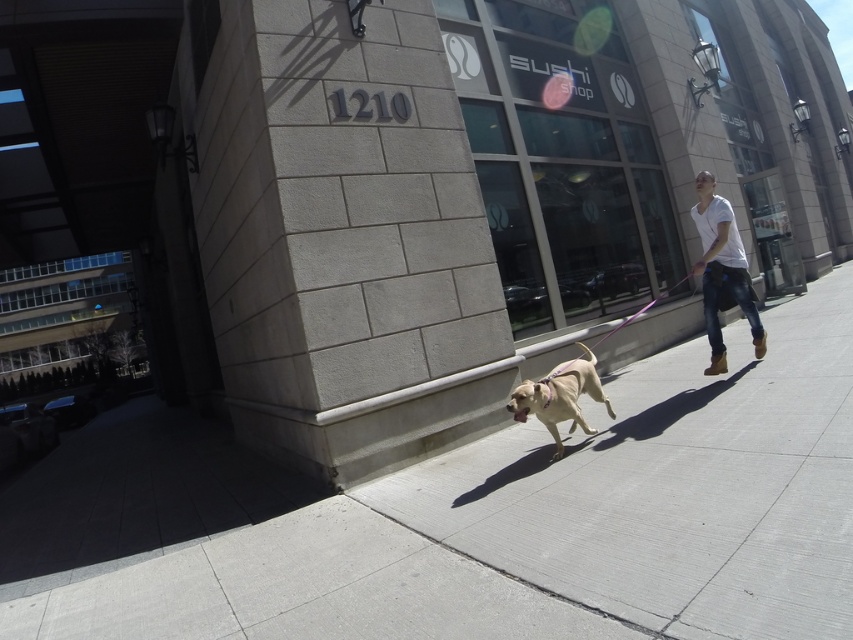
You are standing on the sidewalk and see the man and his dog. Where is the white cotton shirt at right located relative to the point marked at coordinates [722,272]?

The white cotton shirt at right is located at the coordinates [722,272].

You are a delivery drone flying over the urban street scene. You need to land on the gray concrete sidewalk at lower center. What are the coordinates where you should aim to land?

The gray concrete sidewalk at lower center is located at point (x=544, y=524), so you should aim for those coordinates to land safely.

You are standing at the camera position and want to throw a ball to the point marked at coordinates (305, 540). Can you estimate how far you need to throw the ball to reach that point?

The point marked at coordinates (305, 540) is 8.92 feet away from the camera, so you need to throw the ball approximately 8.92 feet to reach it.